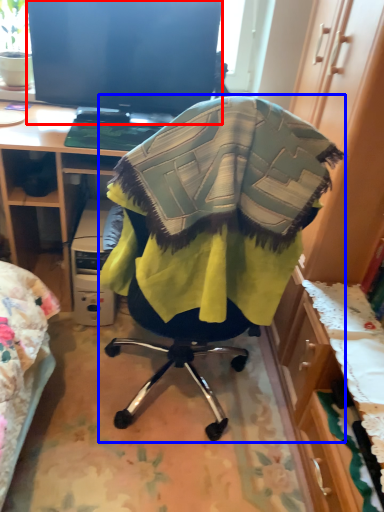
Question: Which object is closer to the camera taking this photo, television (highlighted by a red box) or chair (highlighted by a blue box)?

Choices:
 (A) television
 (B) chair

Answer: (B)